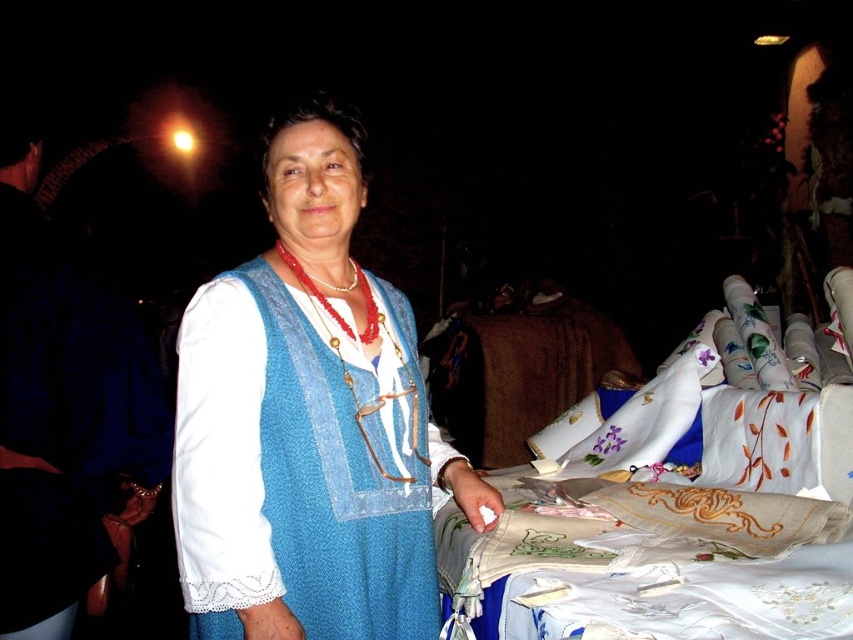
Question: From the image, what is the correct spatial relationship of blue knitted vest at center in relation to white embroidered cloth at center?

Choices:
 (A) below
 (B) above

Answer: (B)

Question: Is blue knitted vest at center smaller than white embroidered cloth at center?

Choices:
 (A) no
 (B) yes

Answer: (B)

Question: Which object appears farthest from the camera in this image?

Choices:
 (A) white embroidered cloth at center
 (B) blue knitted vest at center

Answer: (B)

Question: Does blue knitted vest at center have a larger size compared to white embroidered cloth at center?

Choices:
 (A) yes
 (B) no

Answer: (B)

Question: Which point appears closest to the camera in this image?

Choices:
 (A) (804, 627)
 (B) (294, 285)

Answer: (A)